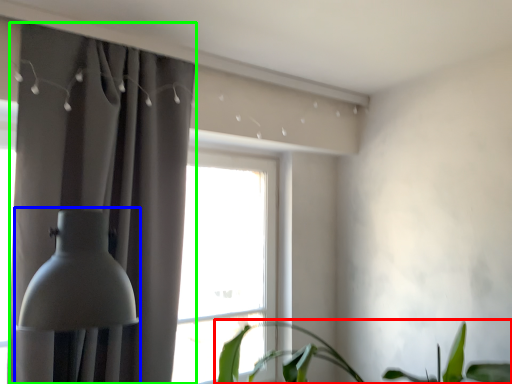
Question: Considering the real-world distances, which object is closest to houseplant (highlighted by a red box)? table lamp (highlighted by a blue box) or curtain (highlighted by a green box).

Choices:
 (A) table lamp
 (B) curtain

Answer: (B)